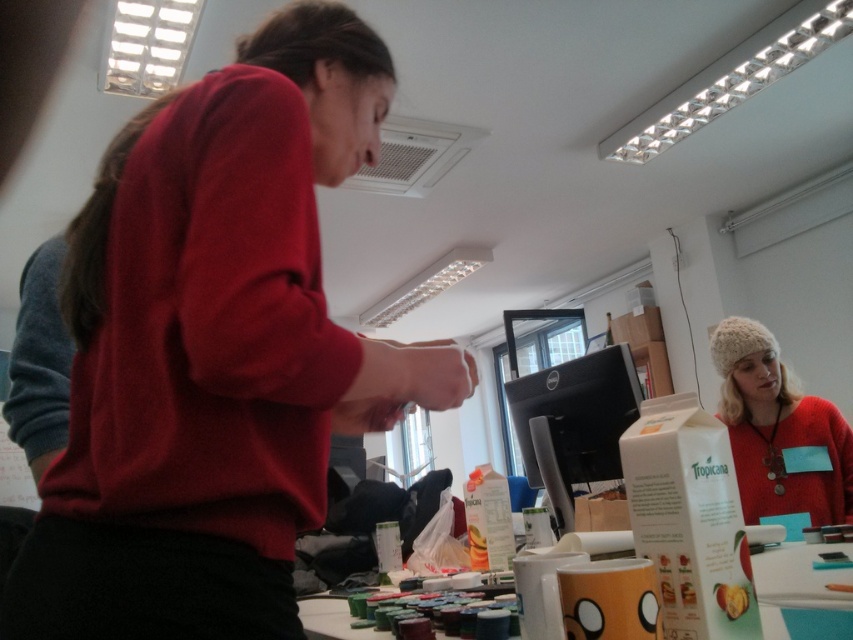
Is black glossy monitor at center closer to the viewer compared to matte orange mug at center?

No, it is behind matte orange mug at center.

Measure the distance between black glossy monitor at center and matte orange mug at center.

black glossy monitor at center is 21.19 inches from matte orange mug at center.

This screenshot has height=640, width=853. Describe the element at coordinates (573, 422) in the screenshot. I see `black glossy monitor at center` at that location.

Find the location of `black glossy monitor at center`. black glossy monitor at center is located at coordinates (573, 422).

Which is below, matte red sweater at center or black glossy monitor at center?

black glossy monitor at center

Between matte red sweater at center and black glossy monitor at center, which one has less height?

Standing shorter between the two is black glossy monitor at center.

This screenshot has height=640, width=853. I want to click on matte red sweater at center, so click(x=215, y=349).

Locate an element on the screen. Image resolution: width=853 pixels, height=640 pixels. matte red sweater at center is located at coordinates (215, 349).

Between knitted woolen hat at right and matte orange mug at center, which one is positioned lower?

matte orange mug at center is lower down.

Is knitted woolen hat at right in front of matte orange mug at center?

No, knitted woolen hat at right is behind matte orange mug at center.

Who is more distant from viewer, (762,476) or (302,605)?

Point (762,476)

Identify the location of knitted woolen hat at right. This screenshot has height=640, width=853. (779, 432).